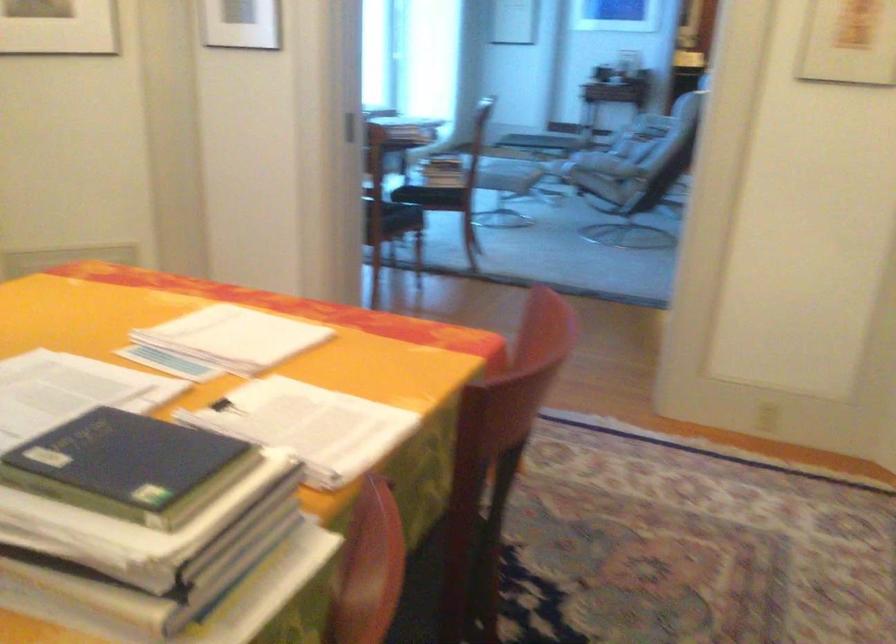
Where would you squeez the black binder clip? Please return your answer as a coordinate pair (x, y).

(226, 408)